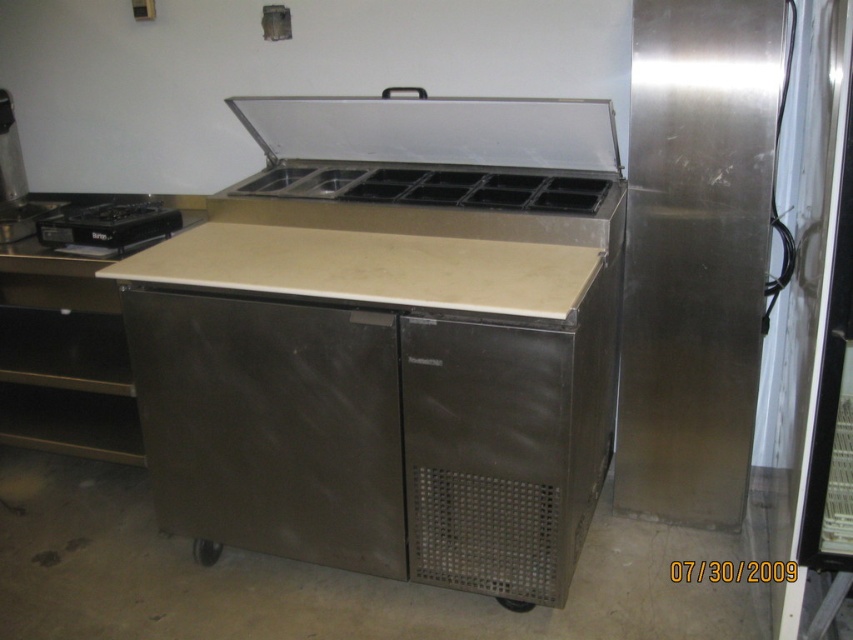
You are a chef standing in front of the stainless steel ice cream freezer at center and the black matte gas stove at left. Which appliance is closer to you?

The stainless steel ice cream freezer at center is closer to the viewer than the black matte gas stove at left.